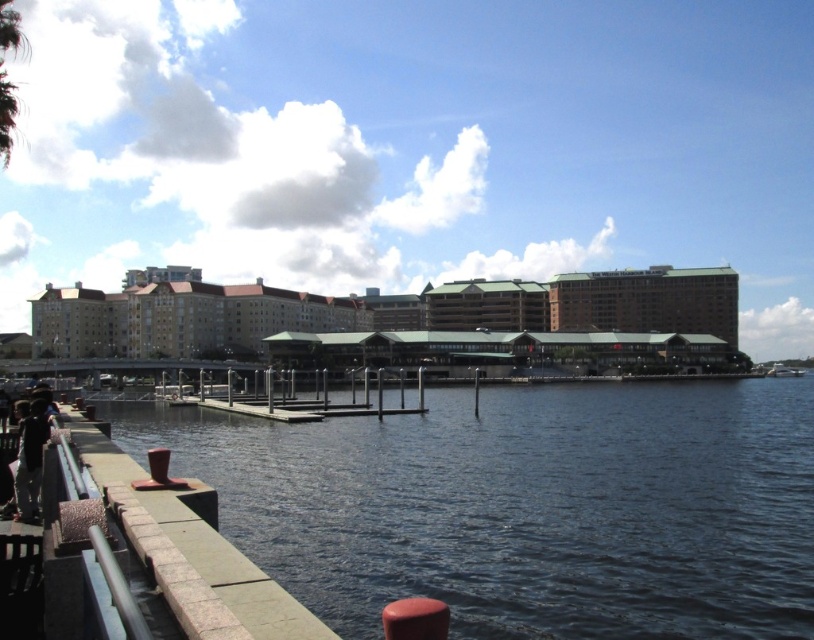
Does dark clothing at lower left appear on the left side of white glossy boat at lower right?

Indeed, dark clothing at lower left is positioned on the left side of white glossy boat at lower right.

Who is shorter, dark clothing at lower left or white glossy boat at lower right?

Standing shorter between the two is dark clothing at lower left.

Who is more distant from viewer, [25,444] or [772,372]?

The point [772,372] is more distant.

The width and height of the screenshot is (814, 640). I want to click on dark clothing at lower left, so click(x=29, y=460).

Describe the element at coordinates (524, 506) in the screenshot. This screenshot has height=640, width=814. I see `dark blue water at lower left` at that location.

Which is more to the left, dark blue water at lower left or brown brick building at center?

brown brick building at center is more to the left.

Does point (372, 476) lie behind point (261, 307)?

That is False.

Image resolution: width=814 pixels, height=640 pixels. Identify the location of dark blue water at lower left. (524, 506).

Can you confirm if dark blue water at lower left is positioned to the left of white glossy boat at lower right?

Yes, dark blue water at lower left is to the left of white glossy boat at lower right.

Locate an element on the screen. The width and height of the screenshot is (814, 640). dark blue water at lower left is located at coordinates (524, 506).